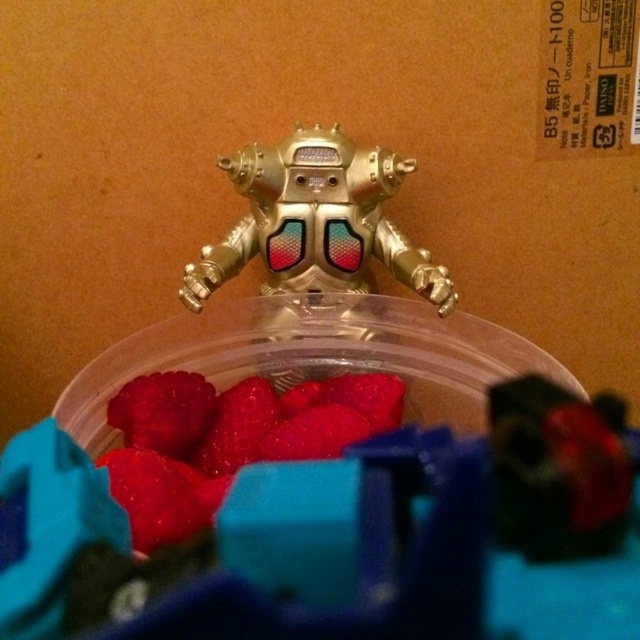
Who is more forward, (193,486) or (323,189)?

Point (193,486)

Which is more to the left, shiny red berries at center or gold metallic robot at center?

shiny red berries at center

Between point (269, 413) and point (253, 244), which one is positioned behind?

Positioned behind is point (253, 244).

Image resolution: width=640 pixels, height=640 pixels. Identify the location of shiny red berries at center. (227, 440).